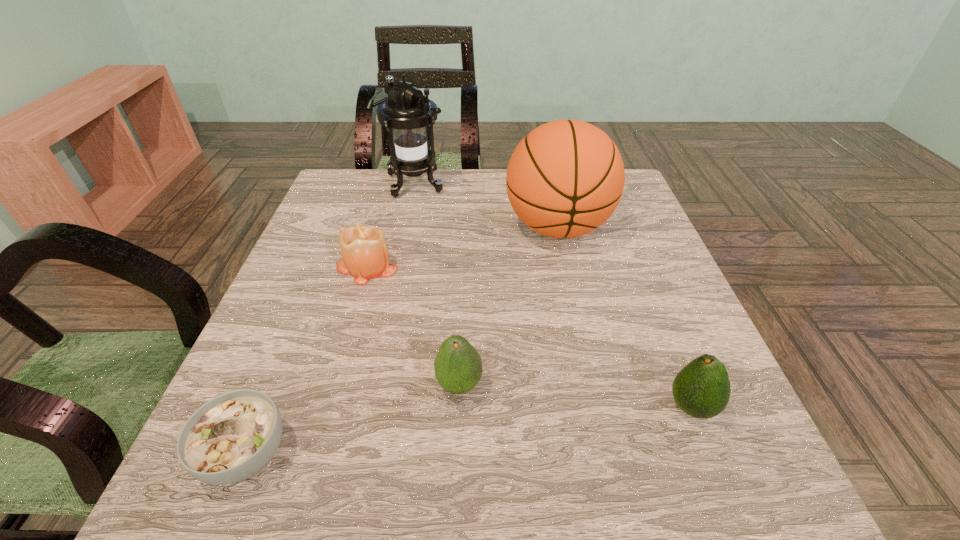
Identify the location of vacant point located between the candle and the right avocado. Image resolution: width=960 pixels, height=540 pixels. (529, 337).

Locate an element on the screen. The height and width of the screenshot is (540, 960). free space between the right avocado and the basketball is located at coordinates (624, 318).

Identify the location of vacant area between the basketball and the right avocado. (624, 318).

Where is `free space between the lantern and the candle`? free space between the lantern and the candle is located at coordinates (390, 225).

Find the location of `empty location between the right avocado and the lantern`. empty location between the right avocado and the lantern is located at coordinates (552, 296).

Identify the location of unoccupied position between the candle and the third object from right to left. (413, 326).

Locate an element on the screen. Image resolution: width=960 pixels, height=540 pixels. unoccupied position between the shortest object and the right avocado is located at coordinates (468, 431).

I want to click on empty location between the soup bowl and the basketball, so click(402, 341).

I want to click on object that is the second closest to the shortest object, so click(364, 250).

Identify which object is located as the second nearest to the right avocado. Please provide its 2D coordinates. Your answer should be formatted as a tuple, i.e. [(x, y)], where the tuple contains the x and y coordinates of a point satisfying the conditions above.

[(565, 178)]